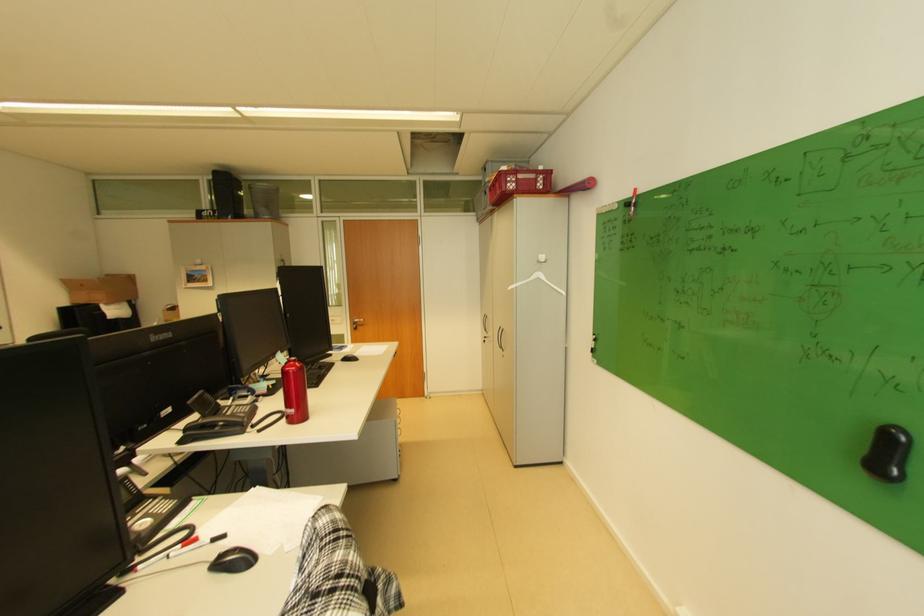
Locate an element on the screen. This screenshot has height=616, width=924. silver door handle is located at coordinates (357, 322).